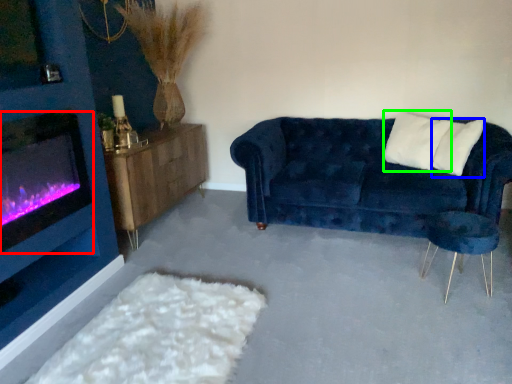
Question: Which object is positioned farthest from wood burning stove (highlighted by a red box)? Select from pillow (highlighted by a blue box) and pillow (highlighted by a green box).

Choices:
 (A) pillow
 (B) pillow

Answer: (A)